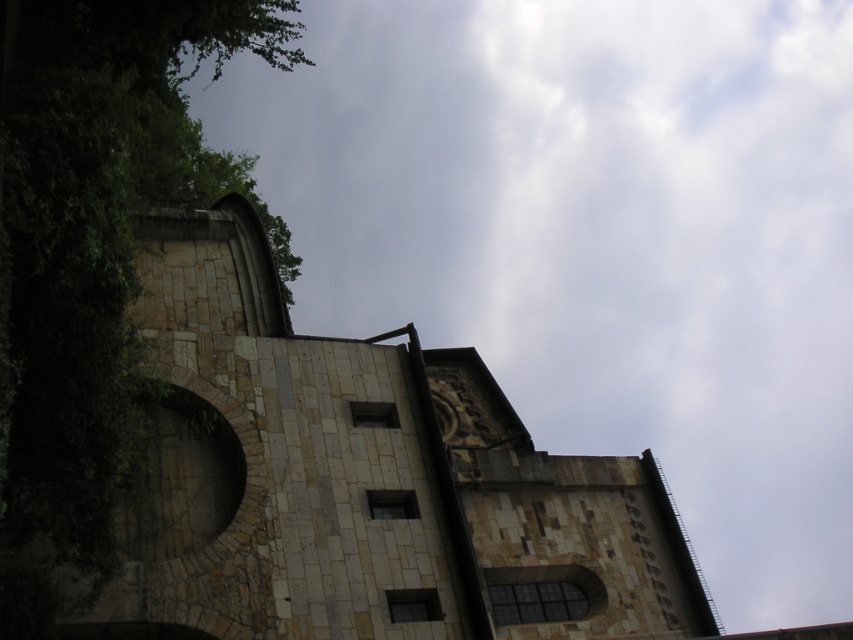
You are standing in front of a stone building and want to take a photo. The camera you have can focus on objects up to 30 meters away. Is the stone church at center within the camera focus range?

The stone church at center is 31.19 meters away from the viewer. Since the camera can only focus up to 30 meters, the stone church at center is just beyond the camera focus range.

You are standing at point (346,502) and want to walk to the entrance of the building. The entrance is located at the base of the rounded structure on the left side. If the distance between you and the entrance is 43.91 meters, can you estimate how long it would take to walk there at a normal pace?

Since the distance between point (346,502) and the entrance is 43.91 meters, walking at a normal pace of about 1.4 meters per second, it would take approximately 31.4 minutes.

You are a photographer planning to capture the stone church at center and the green leafy tree at upper left in a single shot. Based on their heights, which object should you position closer to the camera to ensure both are fully visible in the frame?

The stone church at center is not as tall as the green leafy tree at upper left, so to ensure both are fully visible, you should position the stone church at center closer to the camera since it is shorter and requires less vertical space.